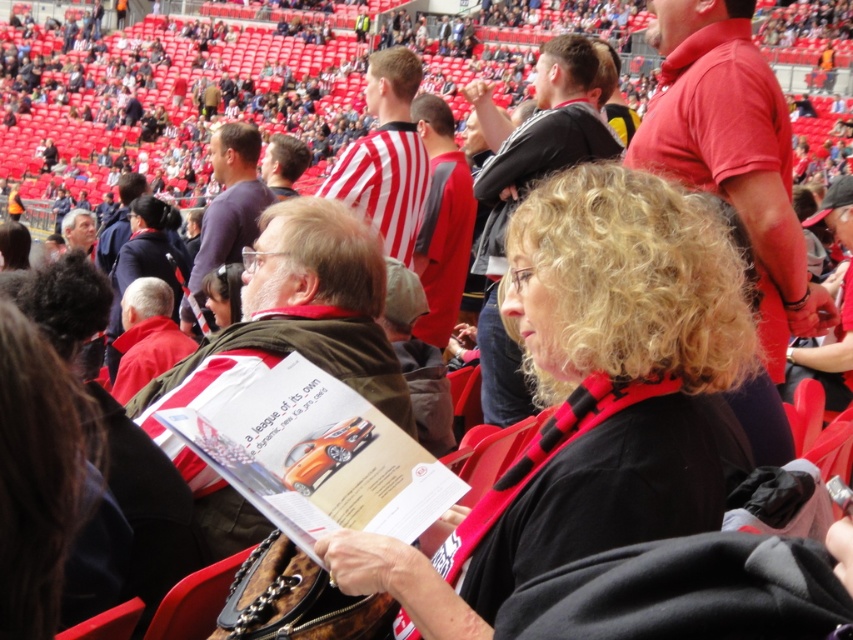
Between matte brown jacket at center and purple matte shirt at upper center, which one appears on the left side from the viewer's perspective?

Positioned to the left is purple matte shirt at upper center.

Can you confirm if matte brown jacket at center is positioned to the right of purple matte shirt at upper center?

Indeed, matte brown jacket at center is positioned on the right side of purple matte shirt at upper center.

Image resolution: width=853 pixels, height=640 pixels. What do you see at coordinates (294, 317) in the screenshot? I see `matte brown jacket at center` at bounding box center [294, 317].

Identify the location of matte brown jacket at center. (294, 317).

Between black matte scarf at center and purple matte shirt at upper center, which one appears on the right side from the viewer's perspective?

From the viewer's perspective, black matte scarf at center appears more on the right side.

Is black matte scarf at center to the right of purple matte shirt at upper center from the viewer's perspective?

Correct, you'll find black matte scarf at center to the right of purple matte shirt at upper center.

Based on the photo, measure the distance between black matte scarf at center and camera.

black matte scarf at center is 16.85 meters from camera.

This screenshot has width=853, height=640. I want to click on black matte scarf at center, so click(590, 396).

Looking at this image, which of these two, black matte scarf at center or matte brown jacket at center, stands taller?

black matte scarf at center is taller.

Is black matte scarf at center smaller than matte brown jacket at center?

Incorrect, black matte scarf at center is not smaller in size than matte brown jacket at center.

Locate an element on the screen. black matte scarf at center is located at coordinates (590, 396).